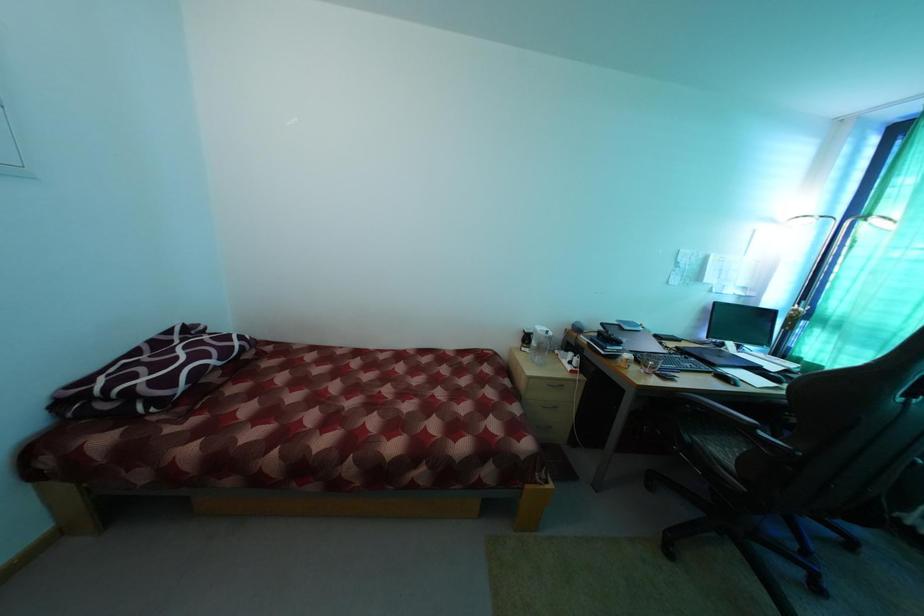
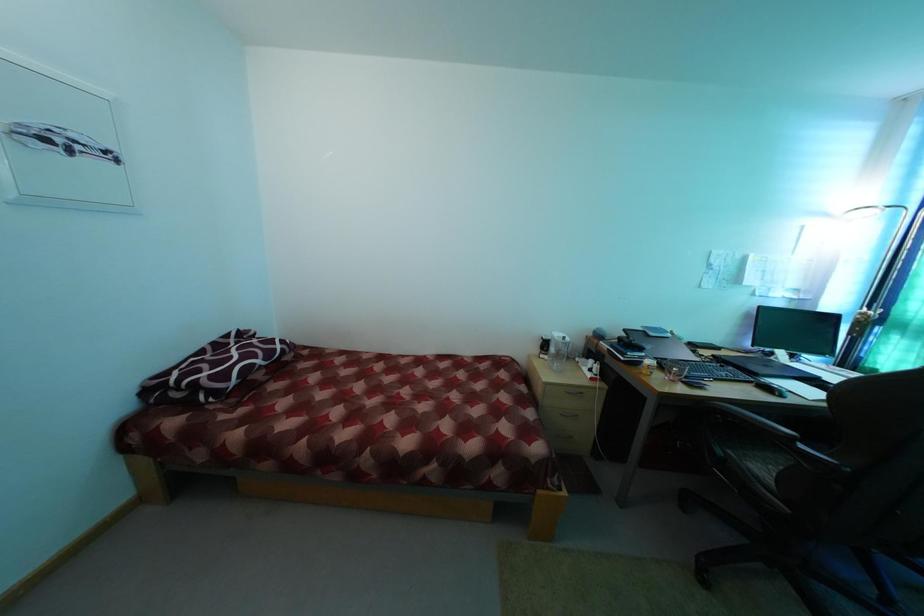
In a continuous first-person perspective shot, in which direction is the camera moving?

The cameraman walked toward right, backward.